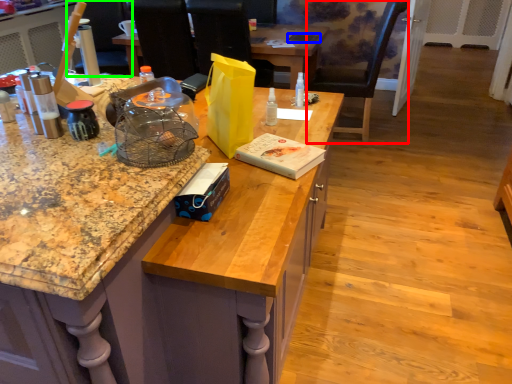
Question: Based on their relative distances, which object is farther from chair (highlighted by a red box)? Choose from laptop (highlighted by a blue box) and armchair (highlighted by a green box).

Choices:
 (A) laptop
 (B) armchair

Answer: (B)